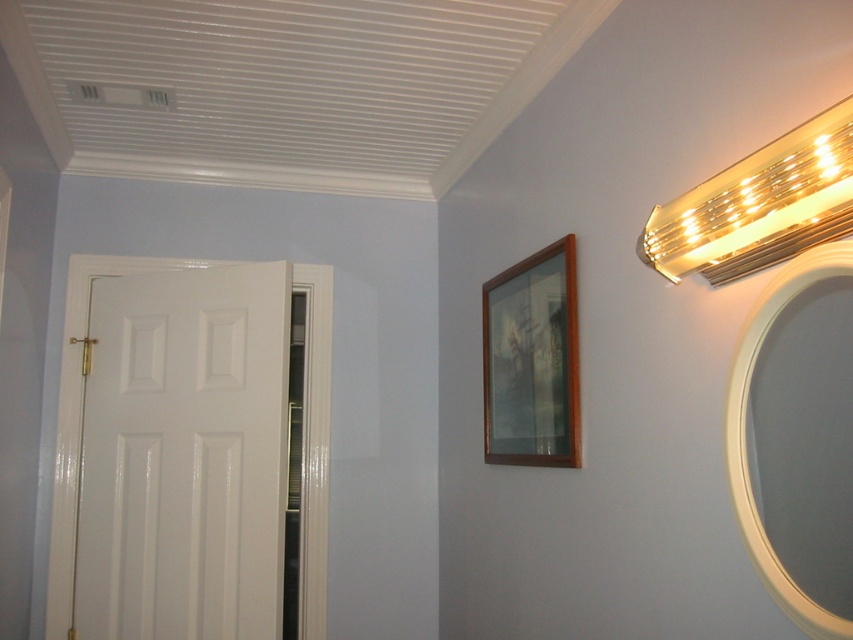
You are standing in the room and want to hang a new decorative item between the wooden picture frame at upper right and the white glossy mirror at upper right. Based on their current positions, which side should you place the new item closer to?

The wooden picture frame at upper right is to the left of the white glossy mirror at upper right, so you should place the new item closer to the right side between them.

You are an interior designer assessing the room layout. You need to determine if the gold metallic light fixture at upper right can be moved to the space currently occupied by the wooden picture frame at upper right. Based on their sizes, is this feasible?

The gold metallic light fixture at upper right is larger in width than the wooden picture frame at upper right. Moving it to the space occupied by the wooden picture frame at upper right may not be feasible due to the size difference unless the space can accommodate a larger fixture.

You are standing in the room and want to hang a new picture between the gold metallic light fixture at upper right and the white glossy mirror at upper right. Which object should you place the new picture above to ensure it is centered between them?

The gold metallic light fixture at upper right is positioned over the white glossy mirror at upper right. To center the new picture between them, place it above the white glossy mirror at upper right since the light fixture is already above it.